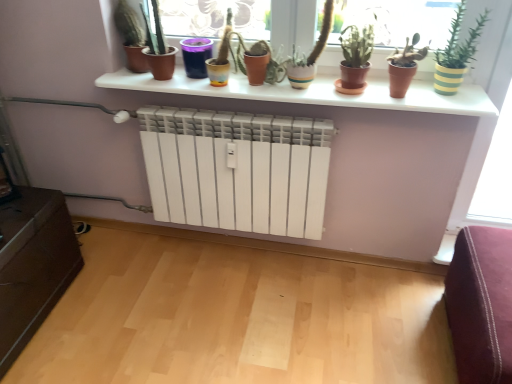
Question: From a real-world perspective, relative to matte terracotta pot at center, the 2th vase from the left, is matte black pot at upper left, which appears as the 1th houseplant when viewed from the left, vertically above or below?

Choices:
 (A) above
 (B) below

Answer: (A)

Question: Looking at their shapes, would you say matte black pot at upper left, which appears as the 1th houseplant when viewed from the left, is wider or thinner than matte terracotta pot at center, which is the first vase from right to left?

Choices:
 (A) thin
 (B) wide

Answer: (A)

Question: Which object is positioned farthest from the green matte cactus at upper left, positioned as the 2th houseplant in left-to-right order?

Choices:
 (A) velvet purple ottoman at lower right
 (B) green matte plant at center, placed as the third houseplant when sorted from right to left
 (C) matte yellow pot at center
 (D) white matte shelf at upper center
 (E) purple glass vase at center, the 1th vase when ordered from left to right

Answer: (A)

Question: Estimate the real-world distances between objects in this image. Which object is farther from the white matte shelf at upper center?

Choices:
 (A) velvet purple ottoman at lower right
 (B) matte terracotta pot at center, the 2th vase from the left
 (C) purple glass vase at center, the 1th vase when ordered from left to right
 (D) terracotta clay pot at center, positioned as the 2th houseplant in right-to-left order
 (E) green matte plant at center, the third houseplant from the left

Answer: (A)